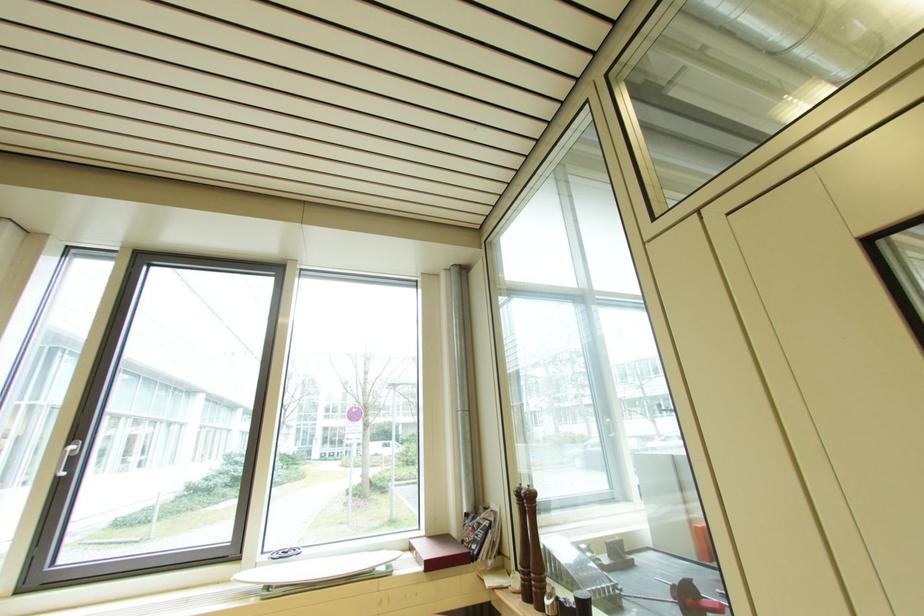
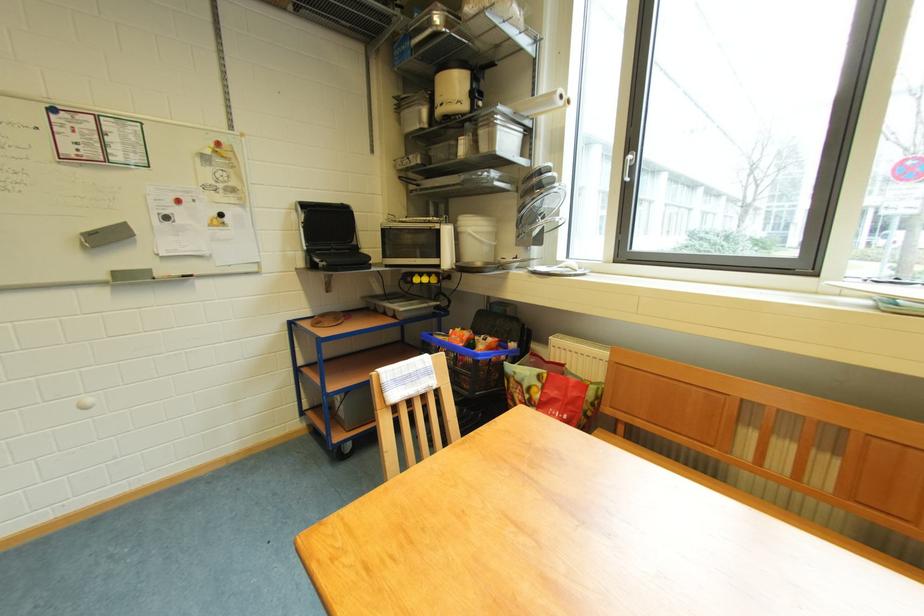
First-person continuous shooting, in which direction is the camera rotating?

The rotation direction of the camera is left-down.